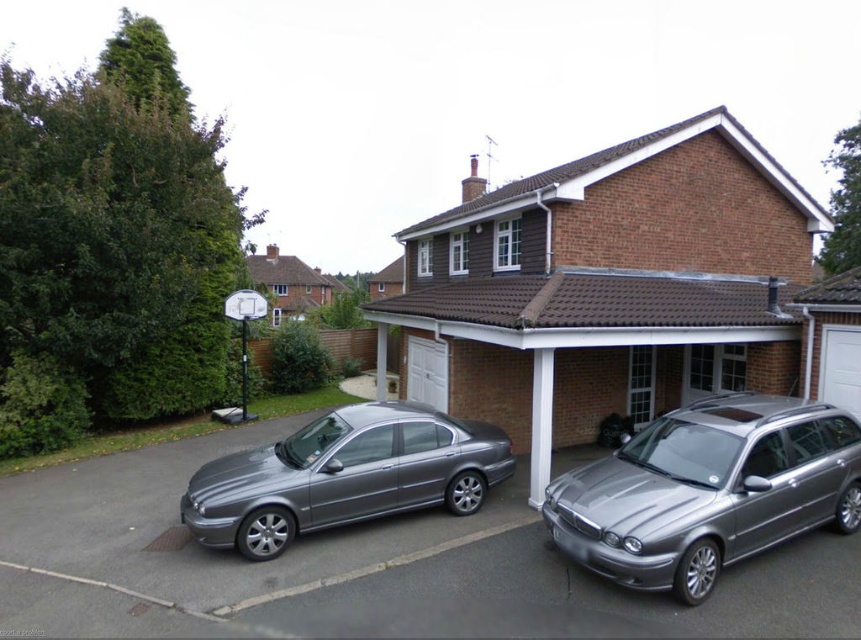
Question: Which of these objects is positioned closest to the satin silver wagon at center?

Choices:
 (A) satin silver car at center
 (B) brown brick garage at center

Answer: (A)

Question: Among these objects, which one is farthest from the camera?

Choices:
 (A) satin silver wagon at center
 (B) satin silver car at center
 (C) satin silver sedan at center
 (D) brown brick garage at center

Answer: (D)

Question: Does brown brick garage at center appear on the left side of satin silver sedan at center?

Choices:
 (A) no
 (B) yes

Answer: (A)

Question: Is satin silver car at center to the right of satin silver sedan at center from the viewer's perspective?

Choices:
 (A) no
 (B) yes

Answer: (A)

Question: Which object is closer to the camera taking this photo?

Choices:
 (A) brown brick garage at center
 (B) satin silver wagon at center
 (C) satin silver car at center
 (D) satin silver sedan at center

Answer: (C)

Question: Does brown brick garage at center have a lesser width compared to satin silver sedan at center?

Choices:
 (A) yes
 (B) no

Answer: (B)